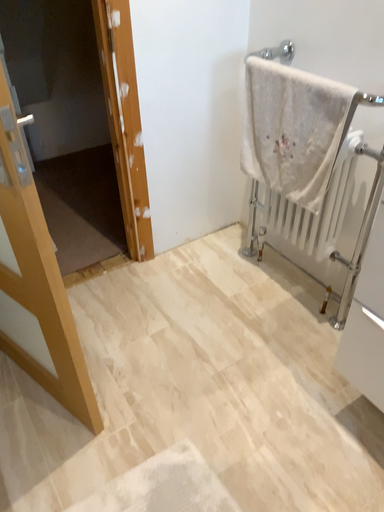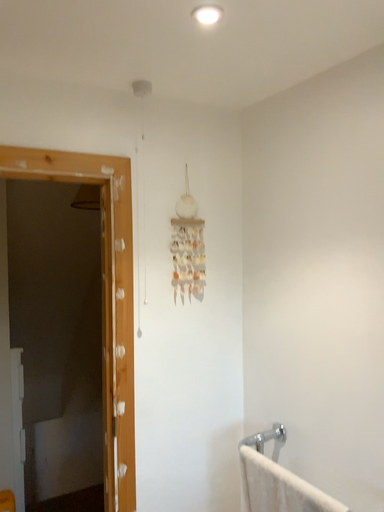
Question: Which way did the camera rotate in the video?

Choices:
 (A) rotated upward
 (B) rotated downward

Answer: (A)